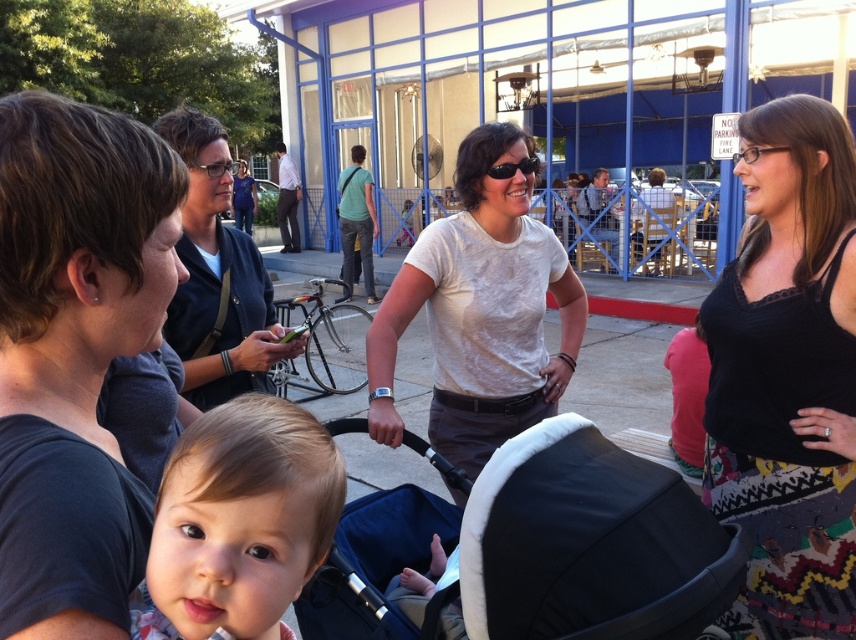
Question: Which point appears farthest from the camera in this image?

Choices:
 (A) (379, 424)
 (B) (67, 484)

Answer: (A)

Question: Is black fabric baby carriage at center above smooth skin baby at center?

Choices:
 (A) yes
 (B) no

Answer: (B)

Question: Which is farther from the white cotton shirt at center?

Choices:
 (A) light blue shirt at center
 (B) dark blue shirt at left
 (C) black matte sunglasses at center

Answer: (A)

Question: Where is white cotton shirt at center located in relation to matte black shirt at upper right in the image?

Choices:
 (A) right
 (B) left

Answer: (B)

Question: Which point appears closest to the camera in this image?

Choices:
 (A) (204, 401)
 (B) (520, 168)

Answer: (A)

Question: In this image, where is black fabric baby carriage at center located relative to matte black shirt at upper right?

Choices:
 (A) below
 (B) above

Answer: (A)